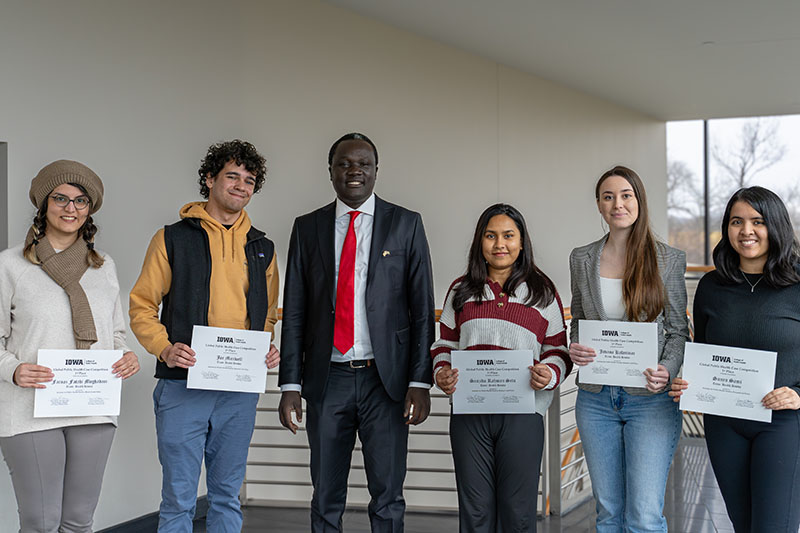
The height and width of the screenshot is (533, 800). Find the location of `certificate`. certificate is located at coordinates (80, 395), (194, 366), (500, 386), (618, 348), (729, 371).